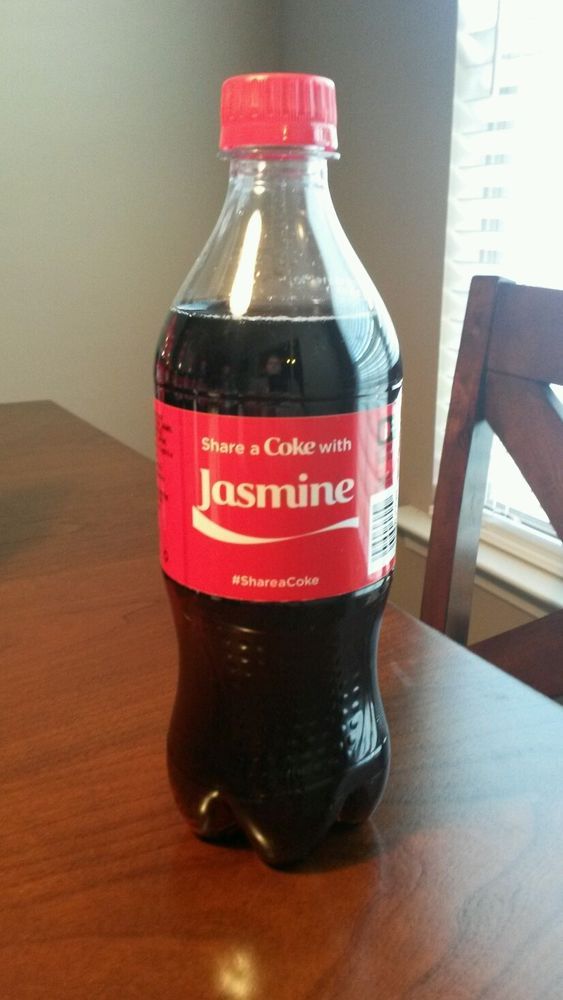
I want to click on window, so click(511, 477).